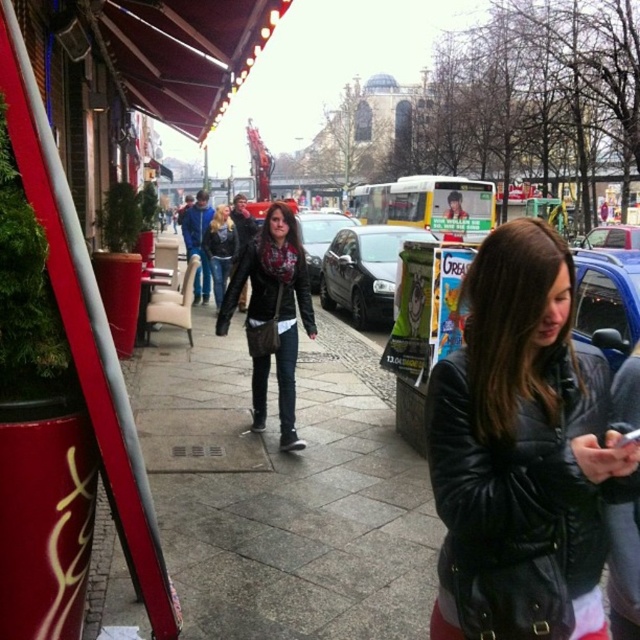
You are a photographer trying to capture both the matte black jacket at center and the shiny silver car at center in a single frame. Based on their sizes in the image, which object should you focus on first to ensure both are in focus?

The matte black jacket at center is not as tall as the shiny silver car at center, so you should focus on the shiny silver car at center first since it is larger and will require more attention to capture details properly.

You are a delivery person needing to cross the street to reach a destination behind the bus. The bus is blocking your path. There is a 9.66 meter gap between the black leather jacket at center and the matte black jacket at center. Can you safely cross the street in this gap without obstructing the bus?

The gap between the black leather jacket at center and matte black jacket at center is 9.66 meters. Since the bus is parked and blocking the path, you can safely cross the street in this gap as it is wide enough for a person to pass through without obstruction.